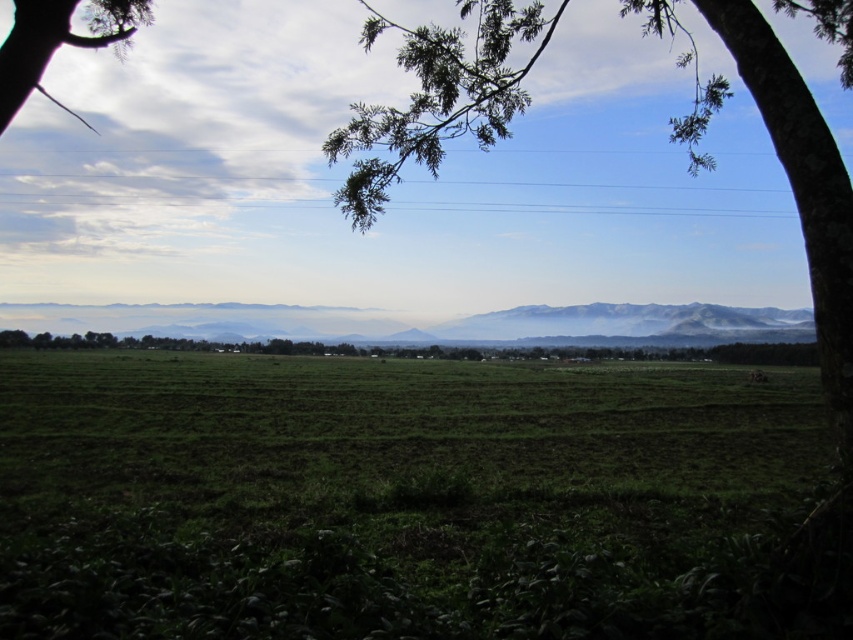
You are a hiker standing on the green matte grass at center and want to reach the green leafy tree at upper left. Which direction should you head towards to get closer to the tree?

The green leafy tree at upper left is located in the upper left direction from the green matte grass at center, so you should head towards the upper left direction to get closer to the tree.

You are standing in the middle of the green matte grass at center and looking towards the green leafy tree at center. Which direction should you walk to reach the tree?

The green leafy tree at center is above the green matte grass at center, so you should walk forward towards the direction where the tree is located above you.